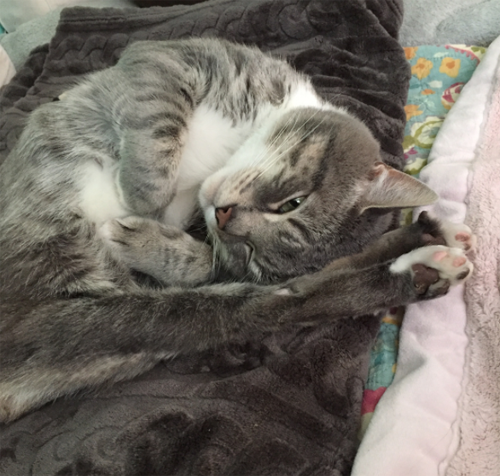
Locate an element on the screen. yellow flowers on blanket is located at coordinates (448, 65), (424, 63), (412, 45), (412, 113), (391, 318).